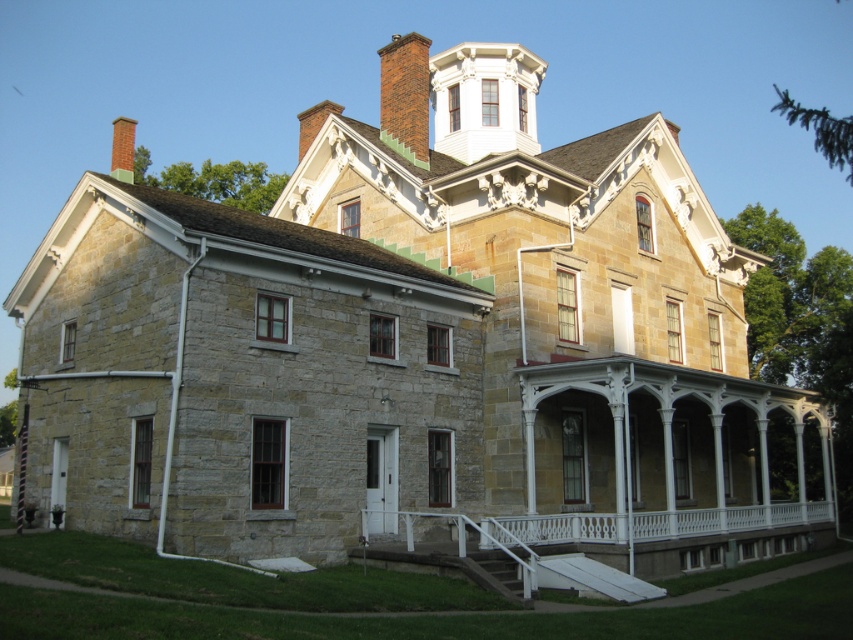
Question: Which object is the farthest from the white painted wood porch at lower center?

Choices:
 (A) brick chimney at upper left
 (B) red brick chimney at upper center

Answer: (A)

Question: Can you confirm if white painted wood porch at lower center is positioned to the right of brick chimney at upper left?

Choices:
 (A) yes
 (B) no

Answer: (A)

Question: Among these points, which one is farthest from the camera?

Choices:
 (A) (393, 72)
 (B) (567, 522)

Answer: (A)

Question: Considering the relative positions of white painted wood porch at lower center and red brick chimney at upper center in the image provided, where is white painted wood porch at lower center located with respect to red brick chimney at upper center?

Choices:
 (A) below
 (B) above

Answer: (A)

Question: Based on their relative distances, which object is farther from the red brick chimney at upper center?

Choices:
 (A) white painted wood porch at lower center
 (B) brick chimney at upper left

Answer: (A)

Question: Is white painted wood porch at lower center above brick chimney at upper left?

Choices:
 (A) no
 (B) yes

Answer: (A)